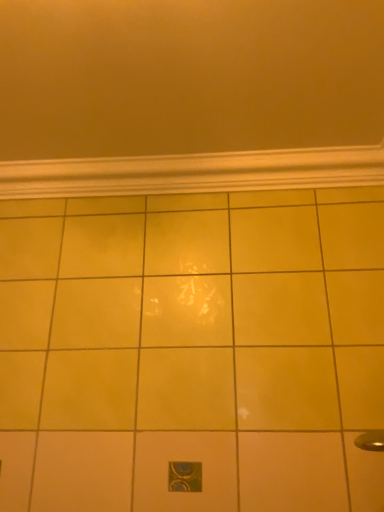
You are a GUI agent. You are given a task and a screenshot of the screen. Output one action in this format:
    pyautogui.click(x=<x>, y=<y>)
    Task: Click on the white textured molding at upper center
    The image size is (384, 512).
    Given the screenshot: What is the action you would take?
    pyautogui.click(x=194, y=173)

What is the approximate height of white textured molding at upper center?

It is 4.08 inches.

What is the approximate width of white textured molding at upper center?

white textured molding at upper center is 10.73 centimeters in width.

This screenshot has width=384, height=512. What do you see at coordinates (194, 173) in the screenshot?
I see `white textured molding at upper center` at bounding box center [194, 173].

Measure the distance between white textured molding at upper center and camera.

white textured molding at upper center is 1.20 meters away from camera.

What are the coordinates of `white textured molding at upper center` in the screenshot? It's located at (194, 173).